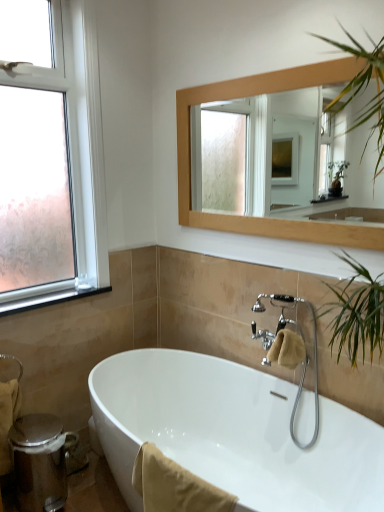
Question: Is beige cotton towel at lower center, which is counted as the 2th bath towel, starting from the right, in front of or behind clear glass window at upper left in the image?

Choices:
 (A) front
 (B) behind

Answer: (A)

Question: Looking at their shapes, would you say beige cotton towel at lower center, the second bath towel from the left, is wider or thinner than clear glass window at upper left?

Choices:
 (A) wide
 (B) thin

Answer: (B)

Question: Which object is positioned farthest from the white glossy bathtub at center?

Choices:
 (A) beige cotton towel at lower left, which is the third bath towel in front-to-back order
 (B) beige cotton towel at lower center, the 3th bath towel in the back-to-front sequence
 (C) wooden frame mirror at upper center
 (D) chrome metallic faucet at upper right
 (E) black rubber window sill at left

Answer: (C)

Question: Which of these objects is positioned farthest from the wooden frame mirror at upper center?

Choices:
 (A) beige cotton towel at lower center, which is counted as the 2th bath towel, starting from the right
 (B) clear glass window at upper left
 (C) black rubber window sill at left
 (D) white glossy bathtub at center
 (E) beige fabric bath towel at center, acting as the first bath towel starting from the right

Answer: (A)